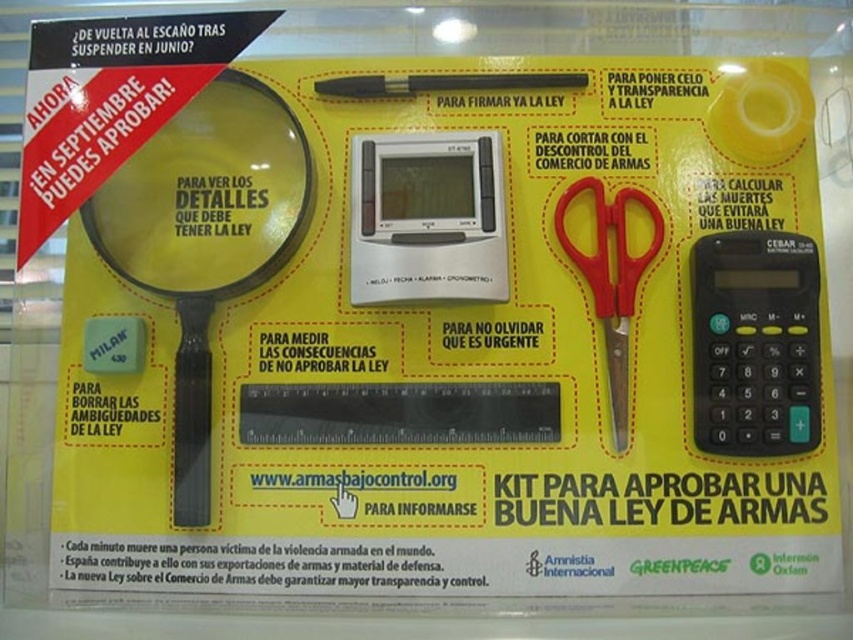
Which is more to the left, black plastic calculator at right or black plastic pen at center?

From the viewer's perspective, black plastic pen at center appears more on the left side.

Does black plastic calculator at right have a lesser width compared to black plastic pen at center?

Indeed, black plastic calculator at right has a lesser width compared to black plastic pen at center.

I want to click on black plastic calculator at right, so click(x=755, y=342).

Between transparent plastic magnifying glass at upper left and red plastic scissors at center right, which one is positioned lower?

red plastic scissors at center right is below.

What do you see at coordinates (207, 195) in the screenshot? The height and width of the screenshot is (640, 853). I see `transparent plastic magnifying glass at upper left` at bounding box center [207, 195].

At what (x,y) coordinates should I click in order to perform the action: click on transparent plastic magnifying glass at upper left. Please return your answer as a coordinate pair (x, y). The height and width of the screenshot is (640, 853). Looking at the image, I should click on (207, 195).

Is point (764, 291) farther from camera compared to point (575, 189)?

No.

Is black plastic calculator at right shorter than red plastic scissors at center right?

Correct, black plastic calculator at right is not as tall as red plastic scissors at center right.

Between point (704, 236) and point (656, 248), which one is positioned behind?

Point (656, 248)

Find the location of a particular element. The image size is (853, 640). black plastic calculator at right is located at coordinates (755, 342).